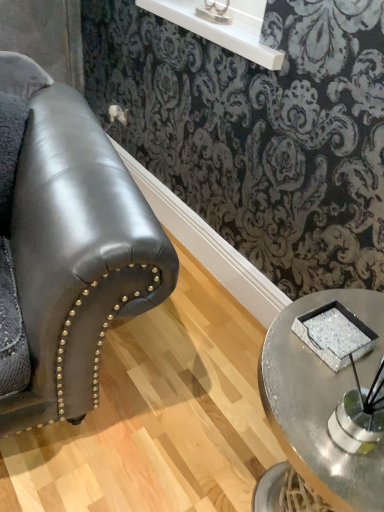
Question: Is sparkly silver tray at center completely or partially inside metallic silver table lamp at upper center?

Choices:
 (A) yes
 (B) no

Answer: (B)

Question: Could you tell me if metallic silver table lamp at upper center is turned towards sparkly silver tray at center?

Choices:
 (A) no
 (B) yes

Answer: (A)

Question: Does metallic silver table lamp at upper center touch sparkly silver tray at center?

Choices:
 (A) yes
 (B) no

Answer: (B)

Question: From a real-world perspective, does metallic silver table lamp at upper center stand above sparkly silver tray at center?

Choices:
 (A) no
 (B) yes

Answer: (B)

Question: Does metallic silver table lamp at upper center appear on the right side of sparkly silver tray at center?

Choices:
 (A) yes
 (B) no

Answer: (B)

Question: From a real-world perspective, is metallic silver table lamp at upper center positioned under sparkly silver tray at center based on gravity?

Choices:
 (A) yes
 (B) no

Answer: (B)

Question: Is sparkly silver tray at center wider than metallic silver table lamp at upper center?

Choices:
 (A) yes
 (B) no

Answer: (A)

Question: Would you say sparkly silver tray at center is outside metallic silver table lamp at upper center?

Choices:
 (A) no
 (B) yes

Answer: (B)

Question: Is sparkly silver tray at center thinner than metallic silver table lamp at upper center?

Choices:
 (A) no
 (B) yes

Answer: (A)

Question: Considering the relative sizes of sparkly silver tray at center and metallic silver table lamp at upper center in the image provided, is sparkly silver tray at center bigger than metallic silver table lamp at upper center?

Choices:
 (A) yes
 (B) no

Answer: (B)

Question: Is there a large distance between sparkly silver tray at center and metallic silver table lamp at upper center?

Choices:
 (A) yes
 (B) no

Answer: (A)

Question: From the image's perspective, does sparkly silver tray at center appear higher than metallic silver table lamp at upper center?

Choices:
 (A) no
 (B) yes

Answer: (A)

Question: Can you confirm if sparkly silver tray at center is wider than metallic silver tray at lower right?

Choices:
 (A) no
 (B) yes

Answer: (A)